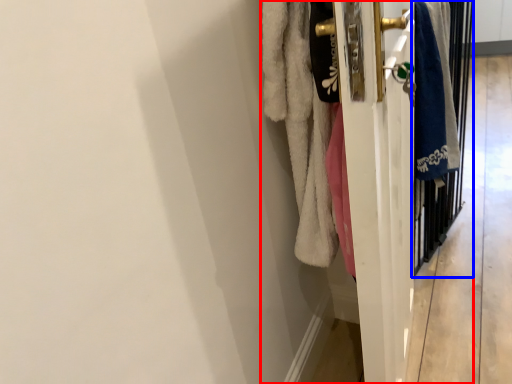
Question: Among these objects, which one is farthest to the camera, closet (highlighted by a red box) or screen door (highlighted by a blue box)?

Choices:
 (A) closet
 (B) screen door

Answer: (B)